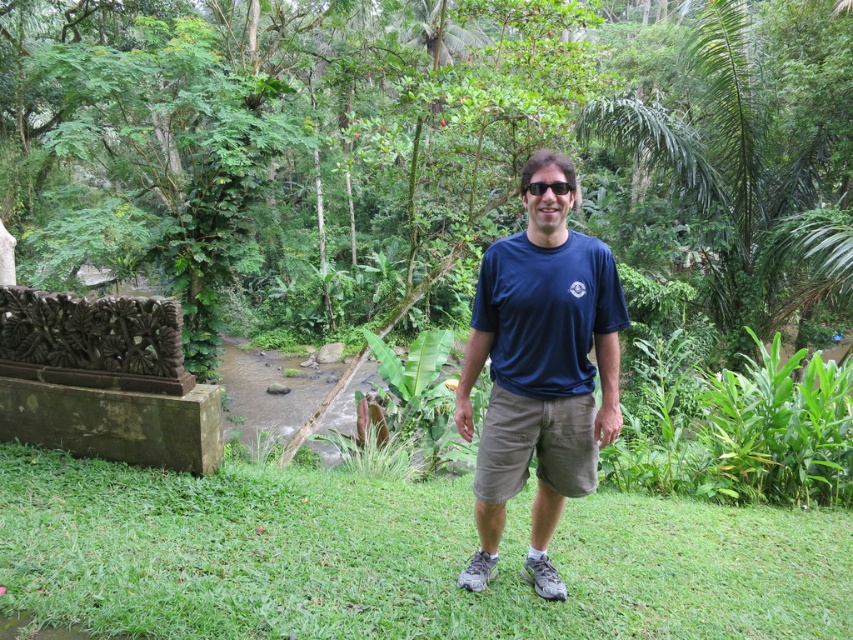
You are a photographer trying to capture a wide shot of the man in the tropical setting. You need to ensure that both the brown wood fence at left and the black plastic sunglasses at center are in focus. Given that your camera can only focus on objects within a 15 meter range, will you be able to capture both objects in focus?

The brown wood fence at left and black plastic sunglasses at center are 17.30 meters apart. Since the camera can only focus within a 15 meter range, the distance between them exceeds the camera capability, so both cannot be in focus simultaneously.